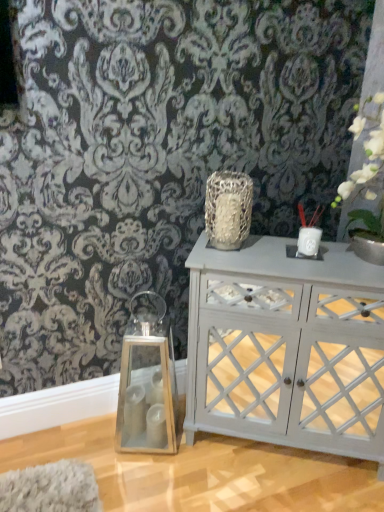
The height and width of the screenshot is (512, 384). Find the location of `vacant space positioned to the left of white ceramic vase at upper right, arranged as the first candle holder when viewed from the top`. vacant space positioned to the left of white ceramic vase at upper right, arranged as the first candle holder when viewed from the top is located at coordinates (263, 251).